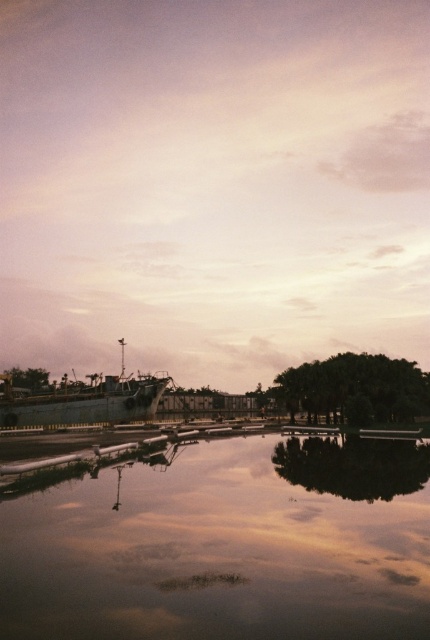
This screenshot has width=430, height=640. What do you see at coordinates (227, 545) in the screenshot?
I see `smooth reflective water at center` at bounding box center [227, 545].

Does point (420, 604) lie behind point (2, 422)?

No, (420, 604) is in front of (2, 422).

Is point (61, 540) behind point (147, 380)?

No, it is in front of (147, 380).

Locate an element on the screen. The height and width of the screenshot is (640, 430). smooth reflective water at center is located at coordinates (227, 545).